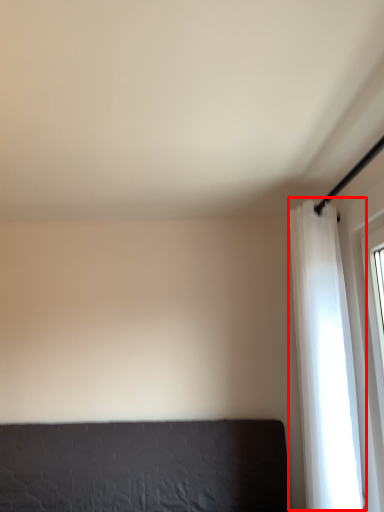
Question: Considering the relative positions of curtain (annotated by the red box) and furniture in the image provided, where is curtain (annotated by the red box) located with respect to the staircase?

Choices:
 (A) right
 (B) left

Answer: (A)